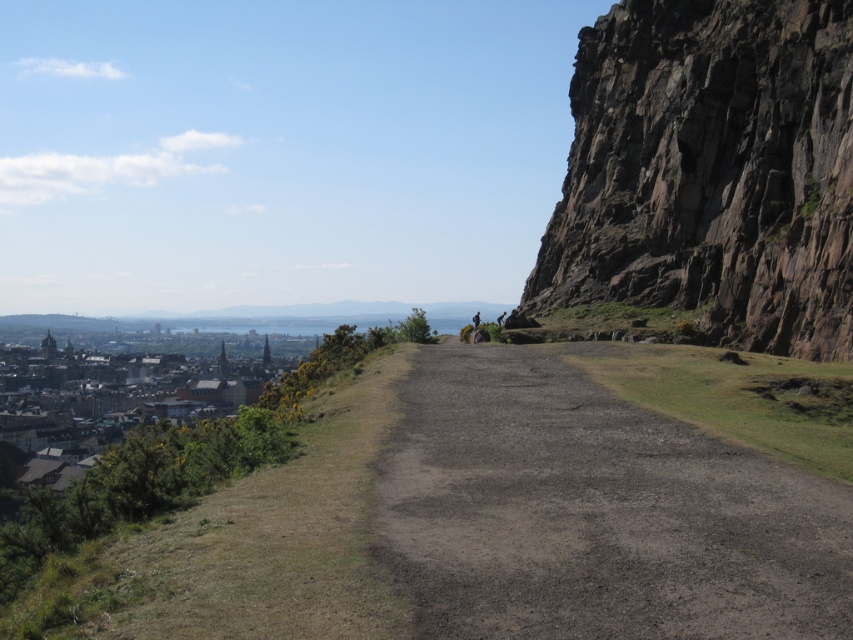
You are standing at the point marked by the coordinate point at (711, 170). Looking around, you see rugged brown rock at right. Which direction should you walk to get to the path that leads to the city below?

The rugged brown rock at right is to your right side. To reach the path leading to the city below, you should walk towards the left away from the rugged brown rock at right since the path is bordered by grassy areas on both sides and stretches into the distance towards the cityscape.